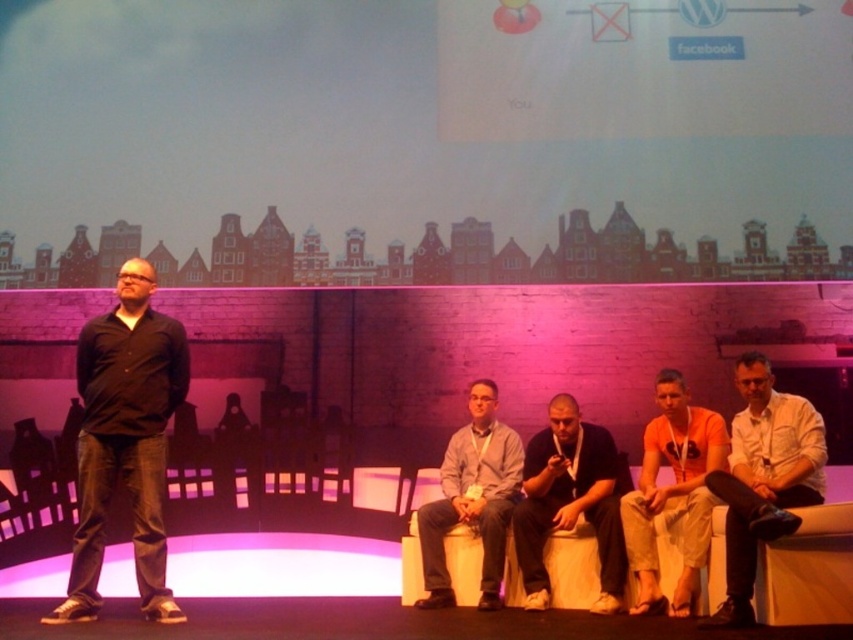
Who is shorter, black matte shirt at left or gray fabric pants at lower center?

gray fabric pants at lower center

Does point (120, 472) lie behind point (491, 406)?

No, (120, 472) is closer to viewer.

The image size is (853, 640). I want to click on black matte shirt at left, so click(125, 440).

Does point (537, 608) come closer to viewer compared to point (641, 518)?

Yes.

From the picture: Does dark gray fabric shirt at center appear over orange cotton shirt at center?

No, dark gray fabric shirt at center is not above orange cotton shirt at center.

Is point (622, 577) less distant than point (677, 374)?

Yes, point (622, 577) is closer to viewer.

Where is `dark gray fabric shirt at center`? This screenshot has height=640, width=853. dark gray fabric shirt at center is located at coordinates (569, 500).

Between black matte shirt at left and dark gray fabric shirt at center, which one has less height?

With less height is dark gray fabric shirt at center.

Is black matte shirt at left smaller than dark gray fabric shirt at center?

No.

The width and height of the screenshot is (853, 640). What do you see at coordinates (125, 440) in the screenshot? I see `black matte shirt at left` at bounding box center [125, 440].

Find the location of `black matte shirt at left`. black matte shirt at left is located at coordinates (125, 440).